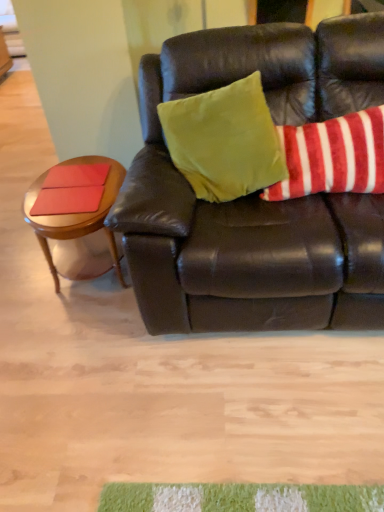
Locate an element on the screen. vacant area that is in front of matte brown leather couch at center is located at coordinates (248, 420).